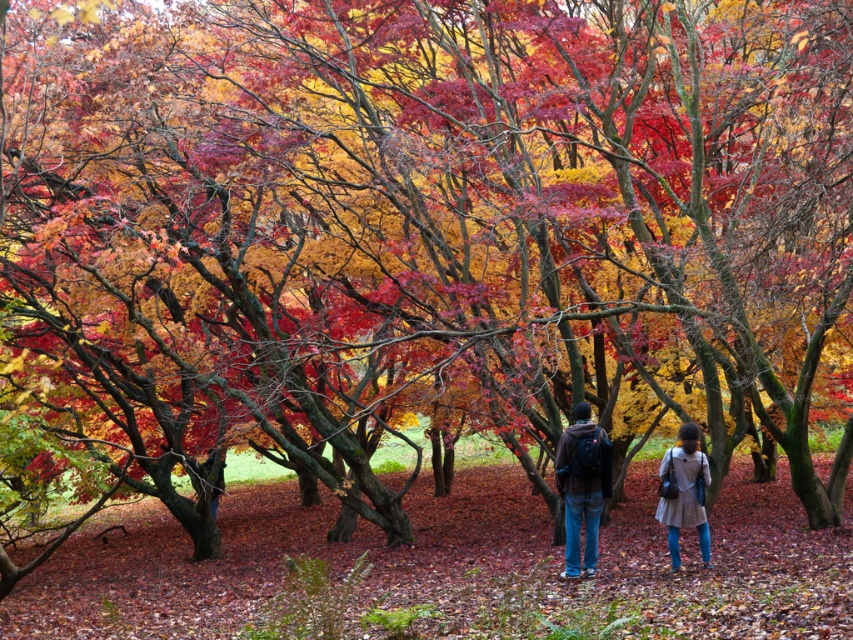
You are planning to take a photo of the two jackets in the scene. Which jacket, the brown leather jacket at center or the matte brown jacket at center, would appear smaller in the photo?

The brown leather jacket at center occupies less space than the matte brown jacket at center, so it would appear smaller in the photo.

You are planning to take a photo of the two people in the autumn forest scene. You want to ensure both the matte brown jacket at center and the light brown fabric coat at lower right are clearly visible in the frame. Given their positions, which person should you focus on first to ensure both are in focus?

You should focus on the matte brown jacket at center first because the light brown fabric coat at lower right is behind it, ensuring both will be in focus if the depth of field includes both distances.